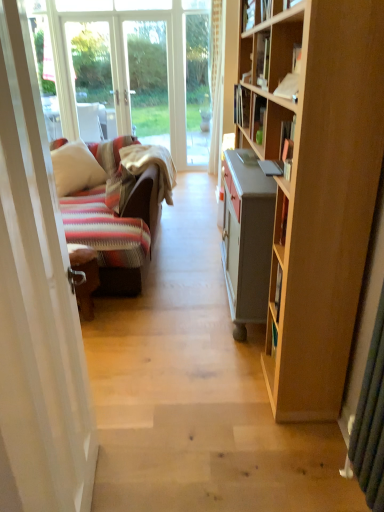
Question: From the image's perspective, would you say hardcover book at upper right, the second book in the front-to-back sequence, is shown under striped fabric pillow at left, which appears as the 1th pillow when viewed from the right?

Choices:
 (A) yes
 (B) no

Answer: (B)

Question: Is striped fabric pillow at left, which appears as the 1th pillow when viewed from the right, at the back of hardcover book at upper right, the 1th book positioned from the back?

Choices:
 (A) yes
 (B) no

Answer: (B)

Question: Does hardcover book at upper right, the 1th book positioned from the back, have a greater width compared to striped fabric pillow at left, acting as the second pillow starting from the left?

Choices:
 (A) yes
 (B) no

Answer: (B)

Question: Considering the relative sizes of hardcover book at upper right, the 1th book positioned from the back, and striped fabric pillow at left, which appears as the 1th pillow when viewed from the right, in the image provided, is hardcover book at upper right, the 1th book positioned from the back, thinner than striped fabric pillow at left, which appears as the 1th pillow when viewed from the right,?

Choices:
 (A) yes
 (B) no

Answer: (A)

Question: Can you confirm if hardcover book at upper right, the second book in the front-to-back sequence, is bigger than striped fabric pillow at left, acting as the second pillow starting from the left?

Choices:
 (A) yes
 (B) no

Answer: (B)

Question: From the image's perspective, relative to white glossy door at left, is matte black book at upper center, which is the 1th book from front to back, above or below?

Choices:
 (A) above
 (B) below

Answer: (A)

Question: Visually, is matte black book at upper center, which is the 1th book from front to back, positioned to the left or to the right of white glossy door at left?

Choices:
 (A) right
 (B) left

Answer: (A)

Question: From a real-world perspective, is matte black book at upper center, which is the 1th book from front to back, physically located above or below white glossy door at left?

Choices:
 (A) above
 (B) below

Answer: (A)

Question: Considering their positions, is matte black book at upper center, which is the 1th book from front to back, located in front of or behind white glossy door at left?

Choices:
 (A) front
 (B) behind

Answer: (B)

Question: Relative to striped fabric pillow at left, acting as the second pillow starting from the left, is white soft pillow at left, marked as the second pillow in a right-to-left arrangement, in front or behind?

Choices:
 (A) front
 (B) behind

Answer: (B)

Question: Is white soft pillow at left, marked as the second pillow in a right-to-left arrangement, to the left or to the right of striped fabric pillow at left, acting as the second pillow starting from the left, in the image?

Choices:
 (A) right
 (B) left

Answer: (B)

Question: Is white soft pillow at left, marked as the second pillow in a right-to-left arrangement, taller or shorter than striped fabric pillow at left, which appears as the 1th pillow when viewed from the right?

Choices:
 (A) tall
 (B) short

Answer: (A)

Question: Considering the positions of white soft pillow at left, marked as the second pillow in a right-to-left arrangement, and striped fabric pillow at left, acting as the second pillow starting from the left, in the image, is white soft pillow at left, marked as the second pillow in a right-to-left arrangement, wider or thinner than striped fabric pillow at left, acting as the second pillow starting from the left,?

Choices:
 (A) thin
 (B) wide

Answer: (B)

Question: From a real-world perspective, is white soft pillow at left, which appears as the 1th pillow when viewed from the left, above or below matte black book at upper center, positioned as the second book in back-to-front order?

Choices:
 (A) above
 (B) below

Answer: (B)

Question: In terms of size, does white soft pillow at left, marked as the second pillow in a right-to-left arrangement, appear bigger or smaller than matte black book at upper center, positioned as the second book in back-to-front order?

Choices:
 (A) big
 (B) small

Answer: (A)